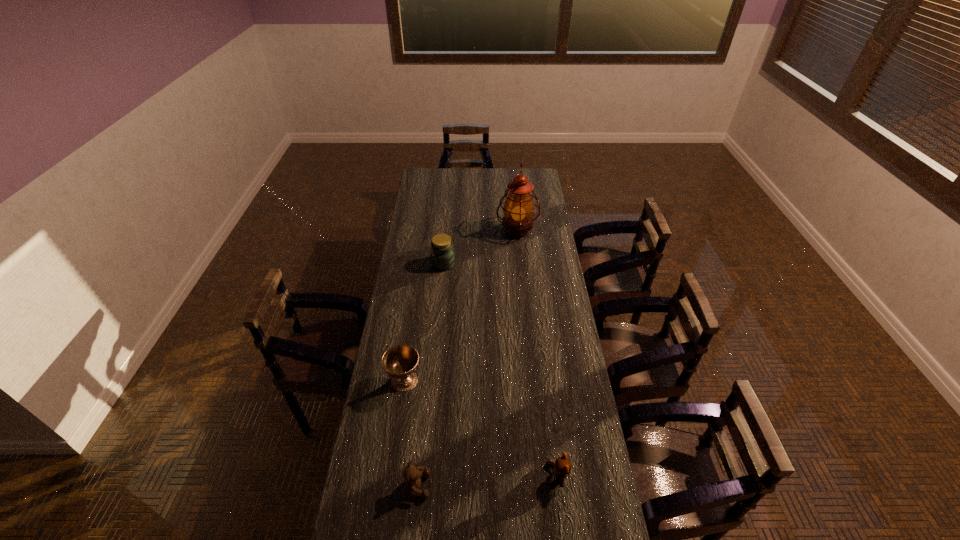
The height and width of the screenshot is (540, 960). In order to click on the tallest object in this screenshot , I will do `click(518, 209)`.

You are a GUI agent. You are given a task and a screenshot of the screen. Output one action in this format:
    pyautogui.click(x=<x>, y=<y>)
    Task: Click on the oil lamp
    The width and height of the screenshot is (960, 540).
    Given the screenshot: What is the action you would take?
    pyautogui.click(x=518, y=209)

What are the coordinates of `jar` in the screenshot? It's located at (442, 254).

Find the location of a particular element. This screenshot has width=960, height=540. the third nearest object is located at coordinates (400, 362).

The width and height of the screenshot is (960, 540). What are the coordinates of `the left teddy bear` in the screenshot? It's located at (412, 475).

Identify the location of the right teddy bear. The width and height of the screenshot is (960, 540). (562, 466).

Where is `vacant area situated 0.360m on the front of the oil lamp`? vacant area situated 0.360m on the front of the oil lamp is located at coordinates pos(524,295).

Identify the location of free space located 0.160m on the front of the jar. (441, 296).

You are a GUI agent. You are given a task and a screenshot of the screen. Output one action in this format:
    pyautogui.click(x=<x>, y=<y>)
    Task: Click on the free location located on the right of the chalice
    The image size is (960, 540).
    Given the screenshot: What is the action you would take?
    pyautogui.click(x=465, y=381)

Identify the location of vacant area situated 0.130m on the front-facing side of the left teddy bear. (471, 485).